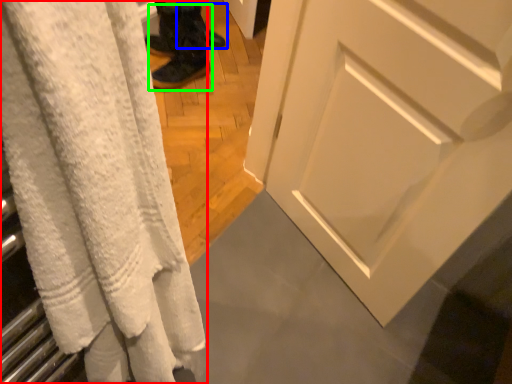
Question: Which object is positioned closest to curtain (highlighted by a red box)? Select from footwear (highlighted by a blue box) and footwear (highlighted by a green box).

Choices:
 (A) footwear
 (B) footwear

Answer: (B)